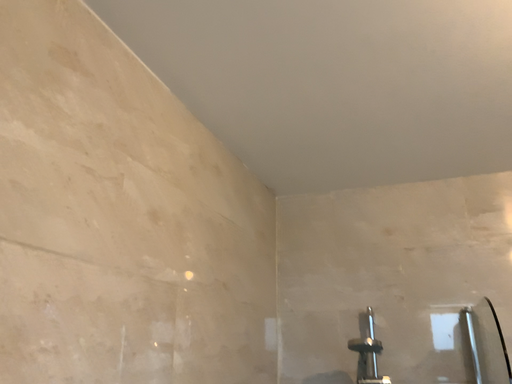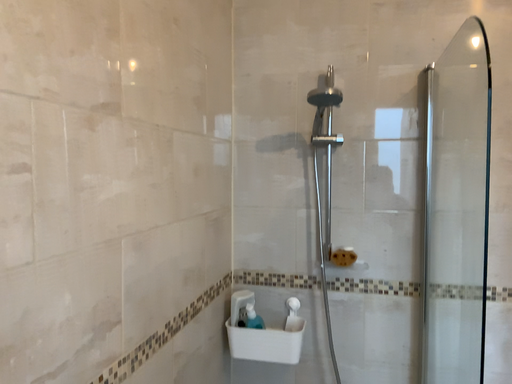
Question: How did the camera likely rotate when shooting the video?

Choices:
 (A) rotated right
 (B) rotated left

Answer: (A)